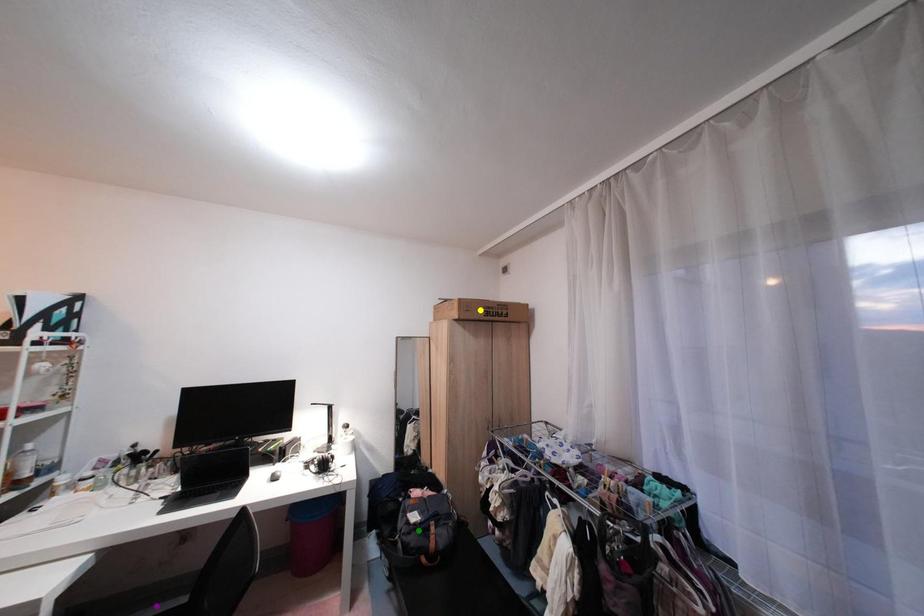
Order these from nearest to farthest:
- green point
- purple point
- yellow point

1. yellow point
2. green point
3. purple point